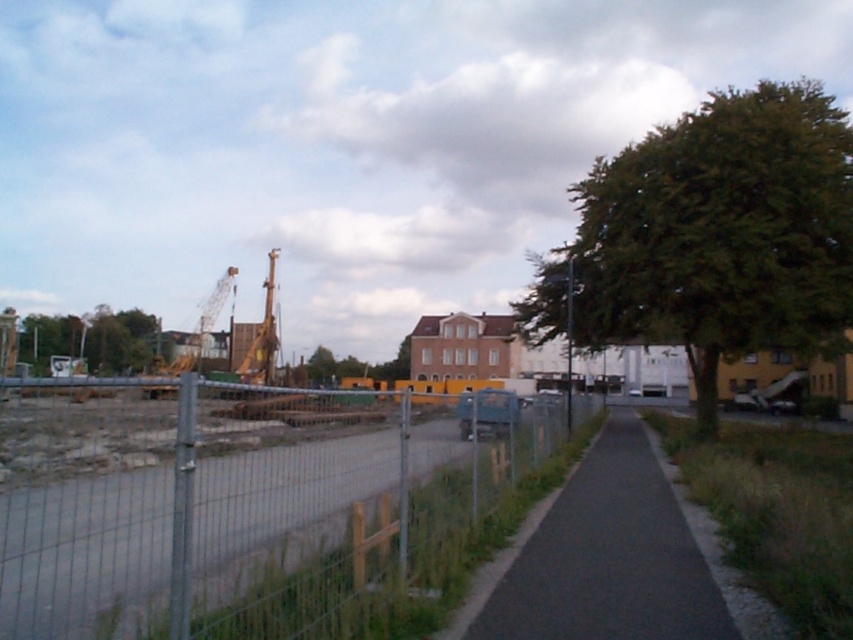
Question: Based on their relative distances, which object is nearer to the yellow metallic crane at left?

Choices:
 (A) metal wire fence at center
 (B) black asphalt pavement at center
 (C) green leafy tree at right
 (D) green leafy tree at center

Answer: (A)

Question: Can you confirm if metal wire fence at center is wider than green leafy tree at right?

Choices:
 (A) no
 (B) yes

Answer: (A)

Question: Which object is the farthest from the yellow metallic crane at center-left?

Choices:
 (A) green leafy tree at left
 (B) black asphalt pavement at center

Answer: (B)

Question: Can you confirm if green leafy tree at center is smaller than yellow metallic crane at center-left?

Choices:
 (A) no
 (B) yes

Answer: (A)

Question: Is green leafy tree at right further to camera compared to yellow metallic crane at center-left?

Choices:
 (A) no
 (B) yes

Answer: (A)

Question: Which point is closer to the camera?

Choices:
 (A) (141, 346)
 (B) (584, 288)
 (C) (434, 525)

Answer: (C)